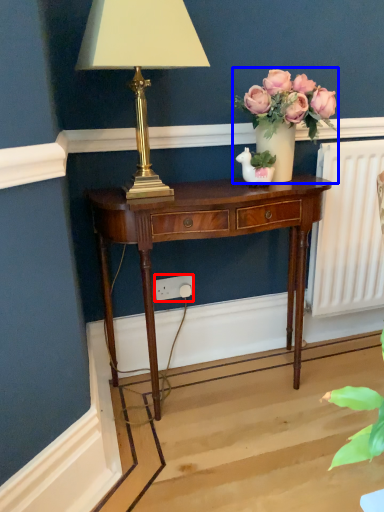
Question: Among these objects, which one is nearest to the camera, power outlet (highlighted by a red box) or houseplant (highlighted by a blue box)?

Choices:
 (A) power outlet
 (B) houseplant

Answer: (B)